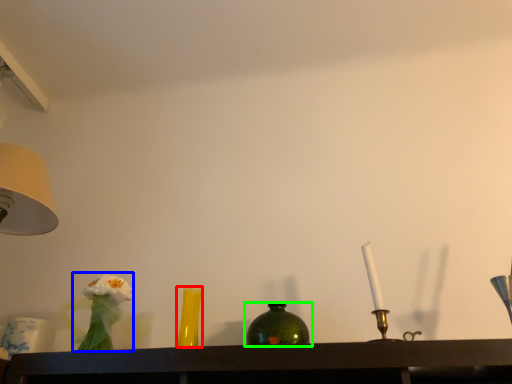
Question: Considering the real-world distances, which object is closest to vase (highlighted by a red box)? floral arrangement (highlighted by a blue box) or bottle (highlighted by a green box).

Choices:
 (A) floral arrangement
 (B) bottle

Answer: (A)